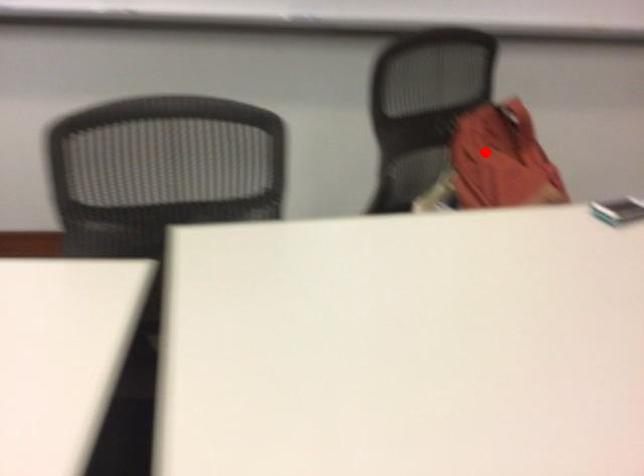
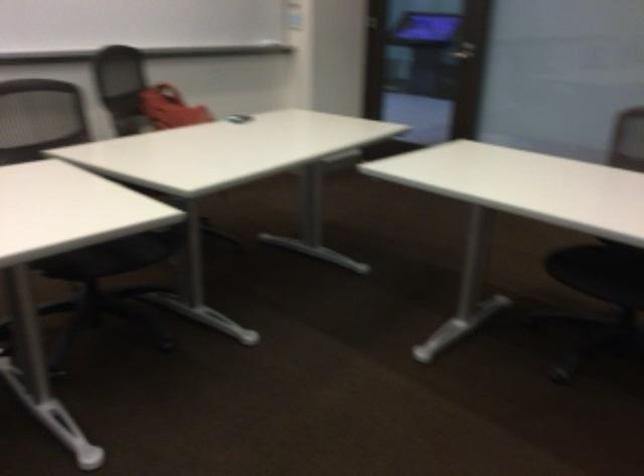
Find the pixel in the second image that matches the highlighted location in the first image.

(169, 107)